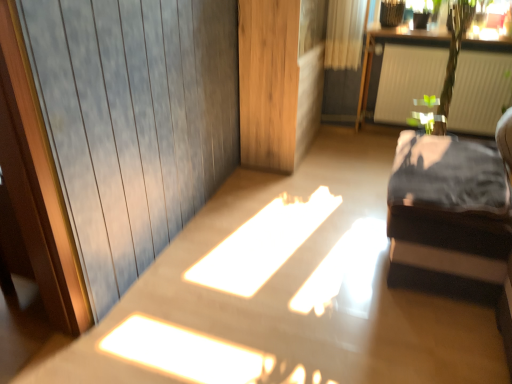
Measure the distance between dark gray fabric ottoman at right and camera.

dark gray fabric ottoman at right is 1.70 meters from camera.

Where is `dark gray fabric ottoman at right`? The height and width of the screenshot is (384, 512). dark gray fabric ottoman at right is located at coordinates (448, 218).

What do you see at coordinates (448, 218) in the screenshot? Image resolution: width=512 pixels, height=384 pixels. I see `dark gray fabric ottoman at right` at bounding box center [448, 218].

Measure the distance between point [434,138] and camera.

The distance of point [434,138] from camera is 2.48 meters.

Locate an element on the screen. Image resolution: width=512 pixels, height=384 pixels. dark gray fabric ottoman at right is located at coordinates (448, 218).